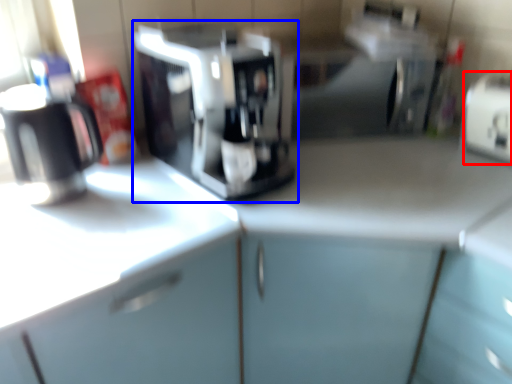
Question: Which point is closer to the camera, appliance (highlighted by a red box) or coffee maker (highlighted by a blue box)?

Choices:
 (A) appliance
 (B) coffee maker

Answer: (B)